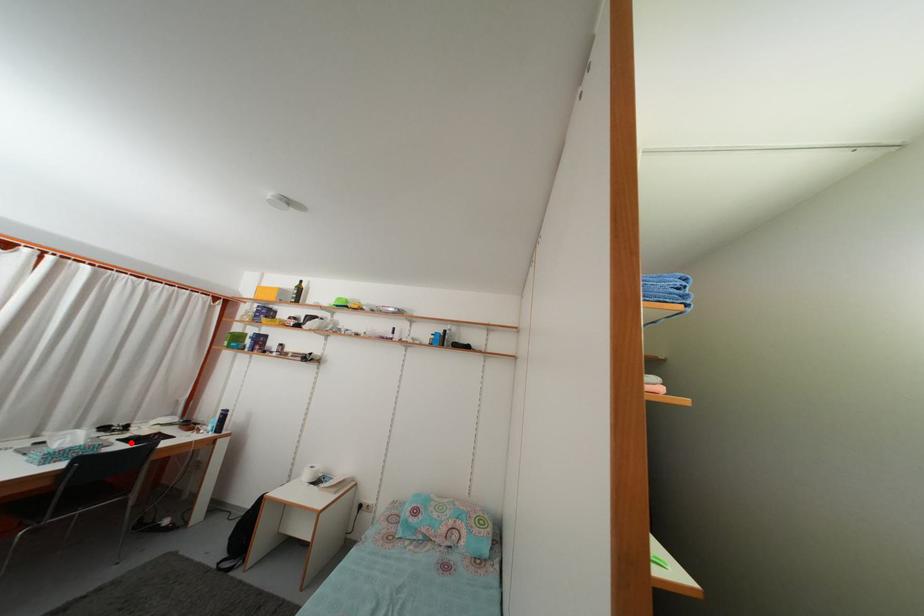
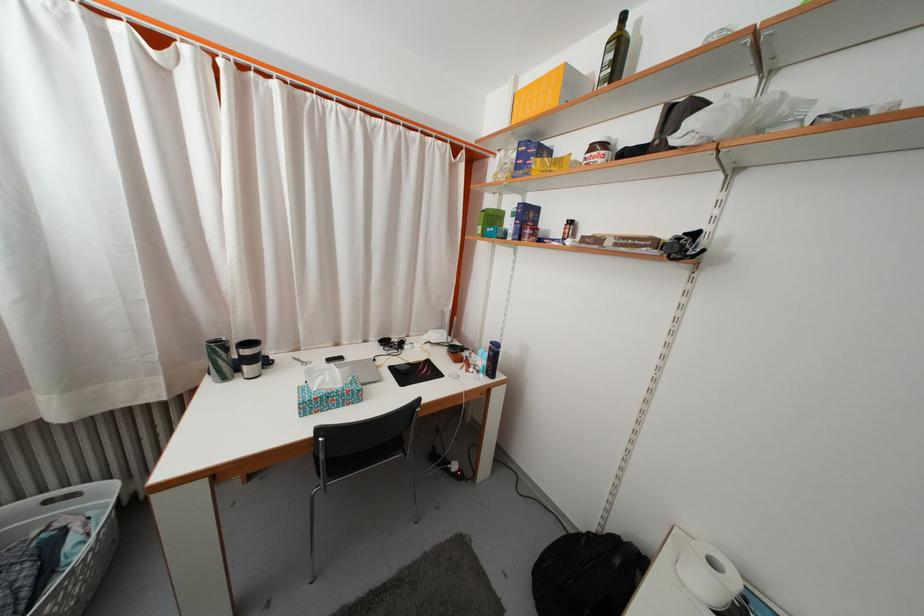
In the second image, find the point that corresponds to the highlighted location in the first image.

(402, 369)